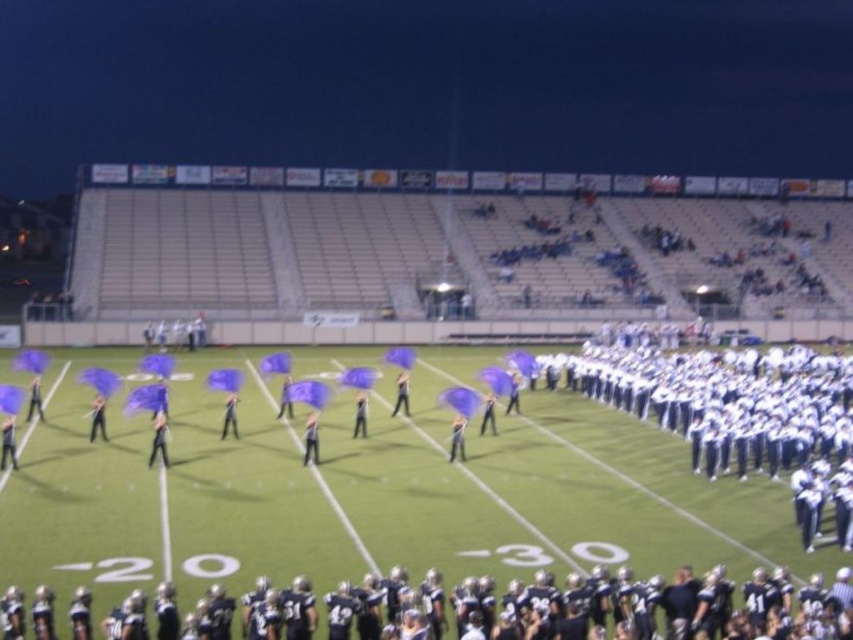
Can you confirm if black uniformed players at lower center is smaller than white uniformed football team at center?

Yes, black uniformed players at lower center is smaller than white uniformed football team at center.

Describe the element at coordinates (660, 608) in the screenshot. This screenshot has width=853, height=640. I see `black uniformed players at lower center` at that location.

Image resolution: width=853 pixels, height=640 pixels. I want to click on black uniformed players at lower center, so click(660, 608).